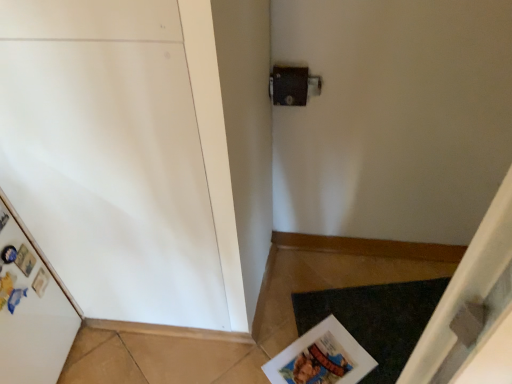
Question: Does dark gray carpet at lower right turn towards matte paper magazine at lower right?

Choices:
 (A) yes
 (B) no

Answer: (A)

Question: From the image's perspective, is dark gray carpet at lower right located above matte paper magazine at lower right?

Choices:
 (A) no
 (B) yes

Answer: (B)

Question: Does dark gray carpet at lower right lie in front of matte paper magazine at lower right?

Choices:
 (A) yes
 (B) no

Answer: (B)

Question: Are dark gray carpet at lower right and matte paper magazine at lower right making contact?

Choices:
 (A) no
 (B) yes

Answer: (A)

Question: Is dark gray carpet at lower right to the right of matte paper magazine at lower right from the viewer's perspective?

Choices:
 (A) no
 (B) yes

Answer: (B)

Question: From a real-world perspective, is dark gray carpet at lower right positioned over matte paper magazine at lower right based on gravity?

Choices:
 (A) yes
 (B) no

Answer: (B)

Question: Can you confirm if matte paper magazine at lower right is bigger than dark gray carpet at lower right?

Choices:
 (A) yes
 (B) no

Answer: (B)

Question: Considering the relative positions of matte paper magazine at lower right and dark gray carpet at lower right in the image provided, is matte paper magazine at lower right in front of dark gray carpet at lower right?

Choices:
 (A) yes
 (B) no

Answer: (A)

Question: From a real-world perspective, is matte paper magazine at lower right on top of dark gray carpet at lower right?

Choices:
 (A) no
 (B) yes

Answer: (B)

Question: From a real-world perspective, is matte paper magazine at lower right beneath dark gray carpet at lower right?

Choices:
 (A) no
 (B) yes

Answer: (A)

Question: Is matte paper magazine at lower right shorter than dark gray carpet at lower right?

Choices:
 (A) yes
 (B) no

Answer: (B)

Question: Is matte paper magazine at lower right looking in the opposite direction of dark gray carpet at lower right?

Choices:
 (A) yes
 (B) no

Answer: (A)

Question: Considering the relative positions of matte paper magazine at lower right and dark gray carpet at lower right in the image provided, is matte paper magazine at lower right to the left or to the right of dark gray carpet at lower right?

Choices:
 (A) left
 (B) right

Answer: (A)